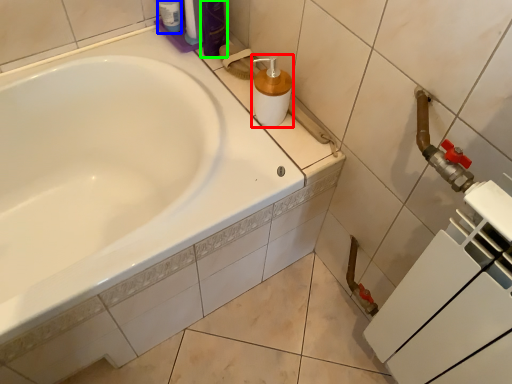
Question: Based on their relative distances, which object is farther from soap dispenser (highlighted by a red box)? Choose from toiletry (highlighted by a blue box) and toiletry (highlighted by a green box).

Choices:
 (A) toiletry
 (B) toiletry

Answer: (A)